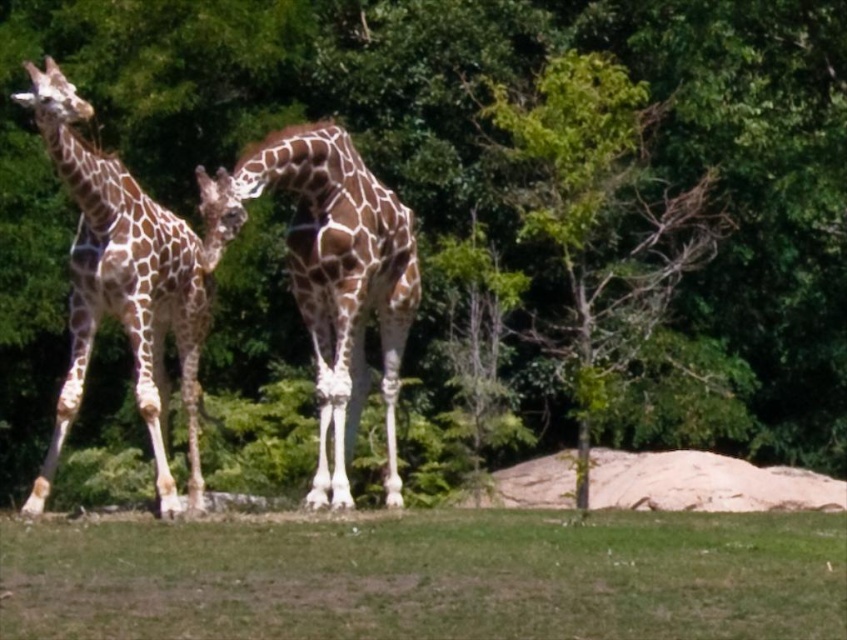
Question: Can you confirm if green grass at lower center is positioned above green leafy tree at center?

Choices:
 (A) no
 (B) yes

Answer: (A)

Question: Estimate the real-world distances between objects in this image. Which object is farther from the green grass at lower center?

Choices:
 (A) spotted giraffe at left
 (B) green leafy tree at center

Answer: (B)

Question: Which point is closer to the camera?

Choices:
 (A) (112, 168)
 (B) (584, 321)
 (C) (474, 529)

Answer: (C)

Question: Is green leafy tree at center to the left of brown spotted giraffe at center from the viewer's perspective?

Choices:
 (A) yes
 (B) no

Answer: (B)

Question: Which object is closer to the camera taking this photo?

Choices:
 (A) green grass at lower center
 (B) green leafy tree at center
 (C) brown spotted giraffe at center

Answer: (A)

Question: Does brown spotted giraffe at center appear on the left side of spotted giraffe at left?

Choices:
 (A) yes
 (B) no

Answer: (B)